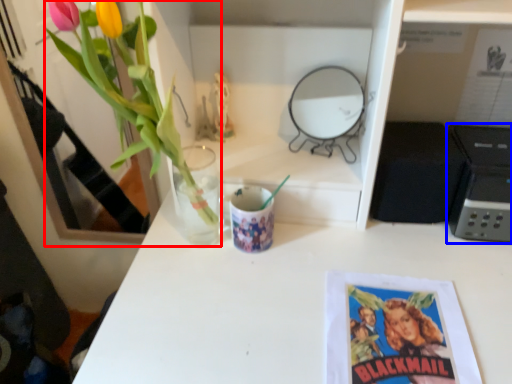
Question: Among these objects, which one is nearest to the camera, floral arrangement (highlighted by a red box) or appliance (highlighted by a blue box)?

Choices:
 (A) floral arrangement
 (B) appliance

Answer: (A)